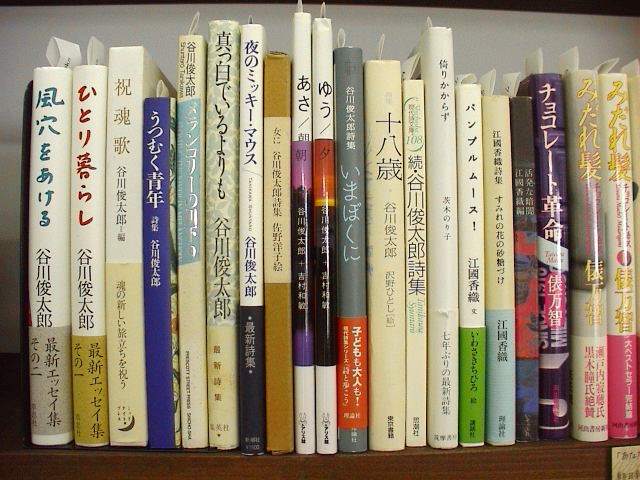
At what (x,y) coordinates should I click in order to perform the action: click on ceiling. Please return your answer as a coordinate pair (x, y). Looking at the image, I should click on (612, 10).